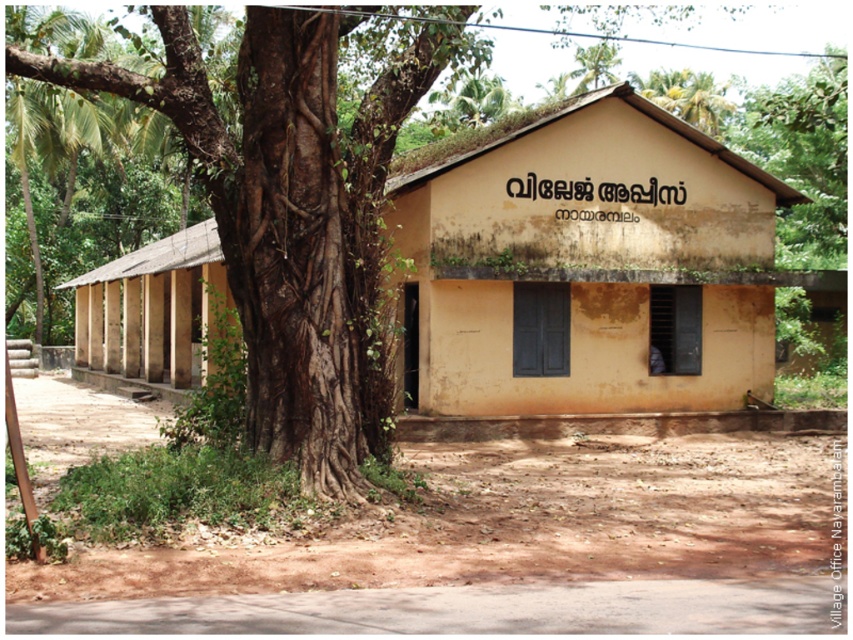
You are a visitor approaching the yellowish matte building at center and the brown rough bark tree at center. Which object will you see first as you walk towards them?

The yellowish matte building at center will be seen first because the brown rough bark tree at center is positioned behind it.

Consider the image. You are standing in front of the rural building and notice two points marked on the image. Which point, point (x=244, y=100) or point (x=173, y=332), is closer to you?

Point (x=244, y=100) is closer to you than point (x=173, y=332).

You are standing in front of the brown rough bark tree at center and want to enter the light brown wooden hut at left. Can you walk directly to the hut without moving around the tree?

The light brown wooden hut at left is behind the brown rough bark tree at center, so you cannot walk directly to it without moving around the tree.